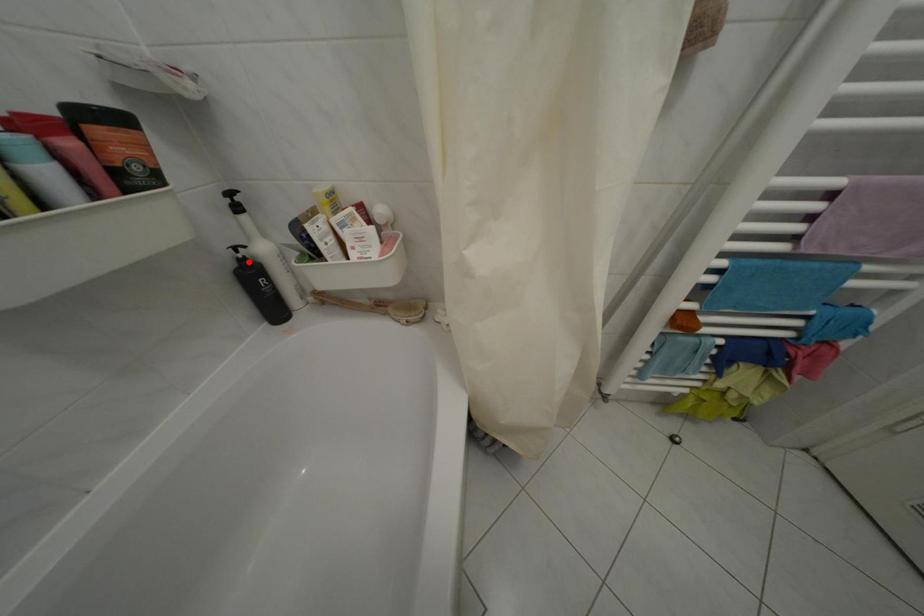
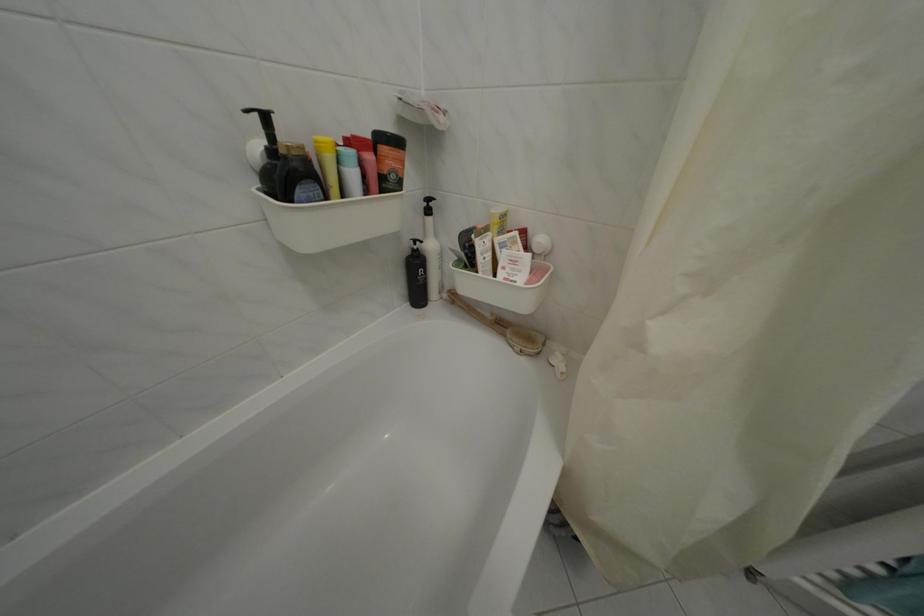
Question: I am providing you with two images of the same scene from different viewpoints. A red point is marked on the first image. Can you still see the location of the red point in image 2?

Choices:
 (A) Yes
 (B) No

Answer: (A)